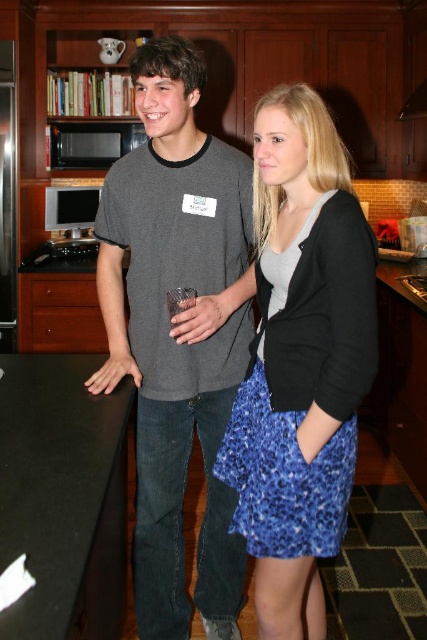
You are a new employee in the kitchen and need to locate the exhaust hood to vent smoke. You see the blue floral skirt at center and the black matte exhaust hood at upper center. Which object is above the other?

The black matte exhaust hood at upper center is above the blue floral skirt at center because the blue floral skirt at center is positioned under it.

You are a delivery person entering the kitchen and need to place a large box between the blue floral skirt at center and the black matte exhaust hood at upper center. Can you estimate if there is enough space between them for the box?

The blue floral skirt at center might be wider than black matte exhaust hood at upper center, so there may not be sufficient space between them for the box. It is recommended to check the exact dimensions before placing the box.